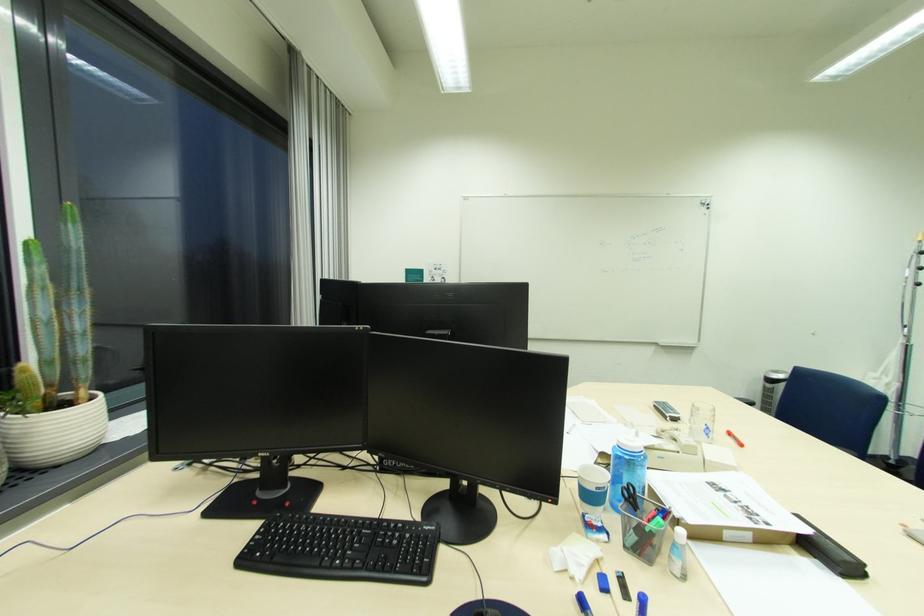
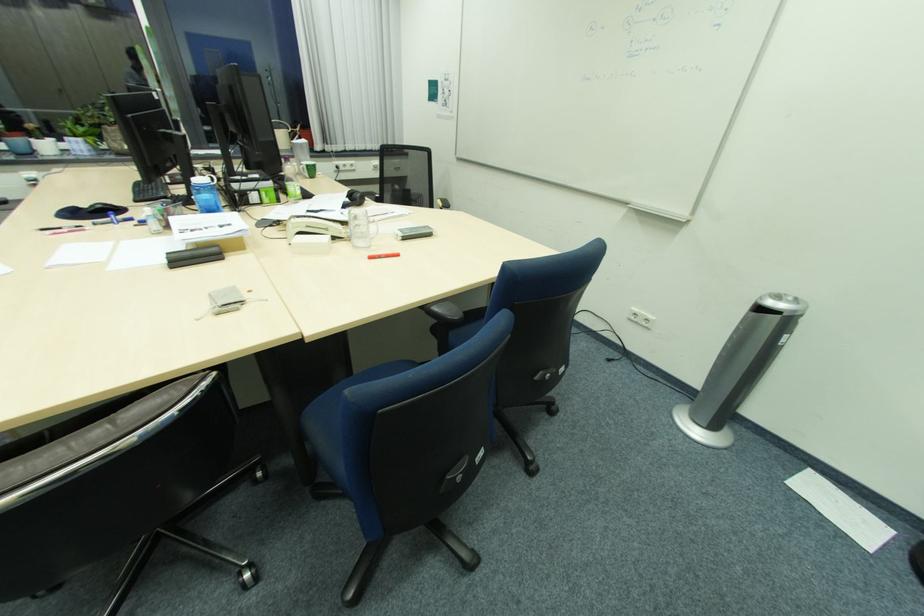
The point at (748, 446) is marked in the first image. Where is the corresponding point in the second image?

(377, 257)